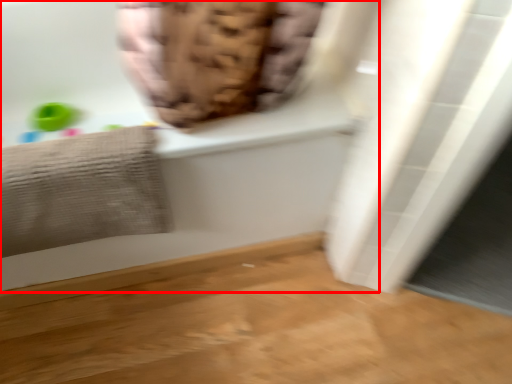
Question: From the image's perspective, what is the correct spatial relationship of bathtub (annotated by the red box) in relation to towel?

Choices:
 (A) above
 (B) below

Answer: (A)